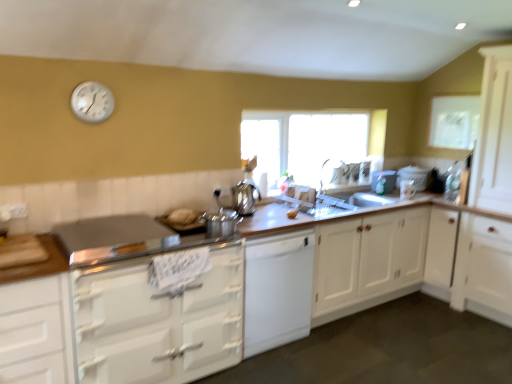
Question: Is white wood cabinet at center, acting as the fourth cabinetry starting from the left, to the right of yellow matte apple at center from the viewer's perspective?

Choices:
 (A) yes
 (B) no

Answer: (A)

Question: Could you tell me if white wood cabinet at center, the first cabinetry in the right-to-left sequence, is turned towards yellow matte apple at center?

Choices:
 (A) no
 (B) yes

Answer: (A)

Question: Is white wood cabinet at center, acting as the fourth cabinetry starting from the left, taller than yellow matte apple at center?

Choices:
 (A) no
 (B) yes

Answer: (B)

Question: Is white wood cabinet at center, acting as the fourth cabinetry starting from the left, smaller than yellow matte apple at center?

Choices:
 (A) no
 (B) yes

Answer: (A)

Question: From a real-world perspective, does white wood cabinet at center, acting as the fourth cabinetry starting from the left, stand above yellow matte apple at center?

Choices:
 (A) yes
 (B) no

Answer: (B)

Question: Based on their sizes in the image, would you say white wood cabinets at center, the 3th cabinetry in the left-to-right sequence, is bigger or smaller than white paper at upper right?

Choices:
 (A) big
 (B) small

Answer: (A)

Question: From a real-world perspective, relative to white paper at upper right, is white wood cabinets at center, the second cabinetry positioned from the right, vertically above or below?

Choices:
 (A) above
 (B) below

Answer: (B)

Question: Considering the positions of white wood cabinets at center, the second cabinetry positioned from the right, and white paper at upper right in the image, is white wood cabinets at center, the second cabinetry positioned from the right, wider or thinner than white paper at upper right?

Choices:
 (A) wide
 (B) thin

Answer: (A)

Question: Considering the relative positions of white wood cabinets at center, the 3th cabinetry in the left-to-right sequence, and white paper at upper right in the image provided, is white wood cabinets at center, the 3th cabinetry in the left-to-right sequence, to the left or to the right of white paper at upper right?

Choices:
 (A) right
 (B) left

Answer: (B)

Question: From their relative heights in the image, would you say clear glass window at center is taller or shorter than white paper at upper right?

Choices:
 (A) short
 (B) tall

Answer: (B)

Question: In terms of width, does clear glass window at center look wider or thinner when compared to white paper at upper right?

Choices:
 (A) wide
 (B) thin

Answer: (A)

Question: Is clear glass window at center inside the boundaries of white paper at upper right, or outside?

Choices:
 (A) outside
 (B) inside

Answer: (A)

Question: Is clear glass window at center to the left or to the right of white paper at upper right in the image?

Choices:
 (A) right
 (B) left

Answer: (B)

Question: Is white paper at upper right wider or thinner than satin silver kettle at center?

Choices:
 (A) thin
 (B) wide

Answer: (A)

Question: Is white paper at upper right to the left or to the right of satin silver kettle at center in the image?

Choices:
 (A) right
 (B) left

Answer: (A)